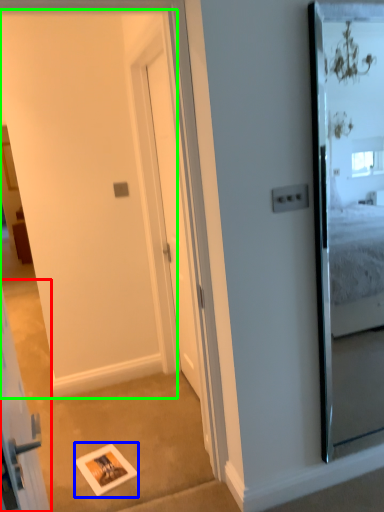
Question: Considering the real-world distances, which object is closest to elevator (highlighted by a red box)? picture frame (highlighted by a blue box) or barn door (highlighted by a green box).

Choices:
 (A) picture frame
 (B) barn door

Answer: (A)